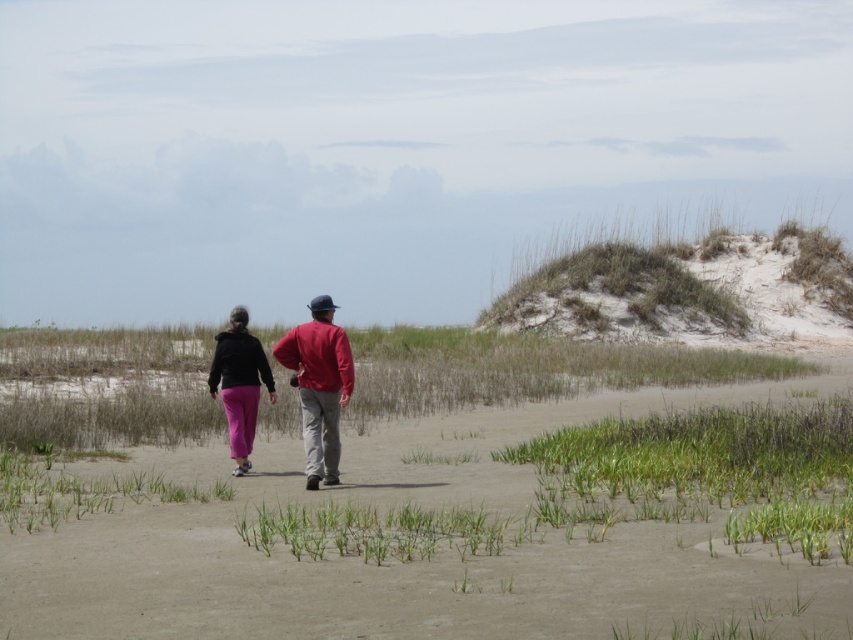
Is sandy beach at center closer to the viewer compared to green grassy sand dune at upper right?

Yes.

Is sandy beach at center below green grassy sand dune at upper right?

Yes.

Which is in front, point (351, 598) or point (769, 244)?

Point (351, 598) is more forward.

You are a GUI agent. You are given a task and a screenshot of the screen. Output one action in this format:
    pyautogui.click(x=<x>, y=<y>)
    Task: Click on the sandy beach at center
    The image size is (853, 640).
    Given the screenshot: What is the action you would take?
    pyautogui.click(x=416, y=561)

Is point (583, 273) behind point (245, 419)?

Yes.

Is green grassy sand dune at upper right to the right of matte black jacket at center from the viewer's perspective?

Indeed, green grassy sand dune at upper right is positioned on the right side of matte black jacket at center.

Between point (520, 312) and point (247, 316), which one is positioned behind?

Positioned behind is point (520, 312).

Identify the location of green grassy sand dune at upper right. The height and width of the screenshot is (640, 853). (689, 291).

Is point (479, 316) in front of point (305, 362)?

No, (479, 316) is behind (305, 362).

Which is behind, point (672, 296) or point (292, 378)?

Positioned behind is point (672, 296).

Identify the location of green grassy sand dune at upper right. Image resolution: width=853 pixels, height=640 pixels. (689, 291).